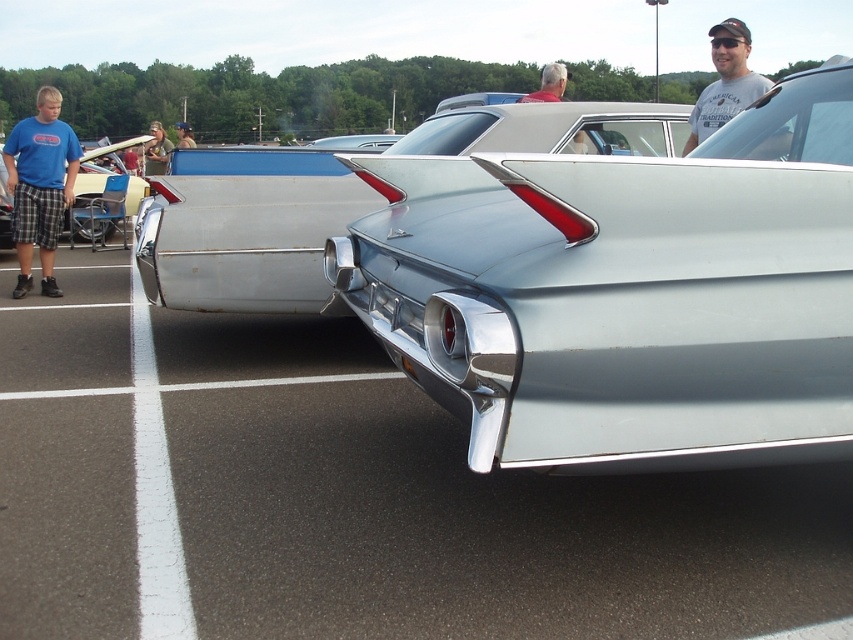
Between shiny chrome tail light at center and camouflage fabric shirt at upper left, which one has more height?

With more height is camouflage fabric shirt at upper left.

Can you confirm if shiny chrome tail light at center is thinner than camouflage fabric shirt at upper left?

Yes.

What do you see at coordinates (245, 232) in the screenshot? I see `shiny chrome tail light at center` at bounding box center [245, 232].

Where is `shiny chrome tail light at center`? shiny chrome tail light at center is located at coordinates (245, 232).

Identify the location of gray t-shirt at upper right. The image size is (853, 640). (724, 81).

Does gray t-shirt at upper right appear under shiny silver tail fin at left?

No.

Who is more forward, (689, 141) or (125, 141)?

Positioned in front is point (689, 141).

This screenshot has width=853, height=640. I want to click on gray t-shirt at upper right, so click(x=724, y=81).

Is shiny silver tail fin at left positioned in front of camouflage fabric shirt at upper left?

Yes, it is in front of camouflage fabric shirt at upper left.

Can you confirm if shiny silver tail fin at left is shorter than camouflage fabric shirt at upper left?

Yes.

Is point (4, 220) positioned behind point (158, 134)?

No, (4, 220) is in front of (158, 134).

Locate an element on the screen. shiny silver tail fin at left is located at coordinates (90, 182).